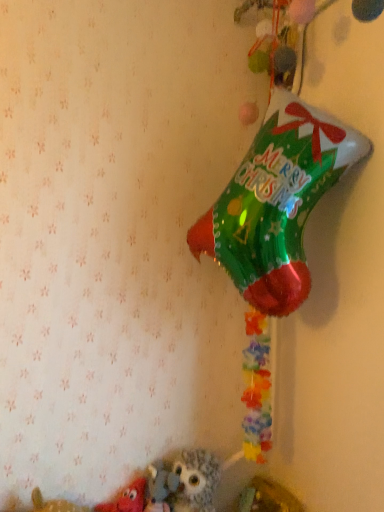
Question: Is the surface of fluffy gray owl at lower center, the second toy in the left-to-right sequence, in direct contact with matte red plush toy at lower left, the first toy viewed from the left?

Choices:
 (A) no
 (B) yes

Answer: (A)

Question: Is fluffy gray owl at lower center, which appears as the 1th toy when viewed from the right, shorter than matte red plush toy at lower left, the first toy viewed from the left?

Choices:
 (A) no
 (B) yes

Answer: (A)

Question: Does fluffy gray owl at lower center, which appears as the 1th toy when viewed from the right, have a larger size compared to matte red plush toy at lower left, the first toy viewed from the left?

Choices:
 (A) yes
 (B) no

Answer: (A)

Question: Does fluffy gray owl at lower center, which appears as the 1th toy when viewed from the right, appear on the left side of matte red plush toy at lower left, the first toy viewed from the left?

Choices:
 (A) yes
 (B) no

Answer: (B)

Question: From the image's perspective, is fluffy gray owl at lower center, which appears as the 1th toy when viewed from the right, beneath matte red plush toy at lower left, acting as the 2th toy starting from the right?

Choices:
 (A) no
 (B) yes

Answer: (A)

Question: From a real-world perspective, is fluffy gray owl at lower center, the second toy in the left-to-right sequence, below matte red plush toy at lower left, acting as the 2th toy starting from the right?

Choices:
 (A) no
 (B) yes

Answer: (A)

Question: Could fluffy gray owl at lower center, which appears as the 1th toy when viewed from the right, be considered to be inside matte red plush toy at lower left, the first toy viewed from the left?

Choices:
 (A) yes
 (B) no

Answer: (B)

Question: Is matte red plush toy at lower left, acting as the 2th toy starting from the right, smaller than fluffy gray owl at lower center, the second toy in the left-to-right sequence?

Choices:
 (A) yes
 (B) no

Answer: (A)

Question: From the image's perspective, is matte red plush toy at lower left, the first toy viewed from the left, on fluffy gray owl at lower center, the second toy in the left-to-right sequence?

Choices:
 (A) no
 (B) yes

Answer: (A)

Question: Is the position of matte red plush toy at lower left, the first toy viewed from the left, more distant than that of fluffy gray owl at lower center, the second toy in the left-to-right sequence?

Choices:
 (A) yes
 (B) no

Answer: (B)

Question: Does matte red plush toy at lower left, acting as the 2th toy starting from the right, have a larger size compared to fluffy gray owl at lower center, the second toy in the left-to-right sequence?

Choices:
 (A) yes
 (B) no

Answer: (B)

Question: Can you confirm if matte red plush toy at lower left, acting as the 2th toy starting from the right, is thinner than fluffy gray owl at lower center, which appears as the 1th toy when viewed from the right?

Choices:
 (A) yes
 (B) no

Answer: (A)

Question: Looking at their shapes, would you say matte red plush toy at lower left, acting as the 2th toy starting from the right, is wider or thinner than fluffy gray owl at lower center, which appears as the 1th toy when viewed from the right?

Choices:
 (A) thin
 (B) wide

Answer: (A)